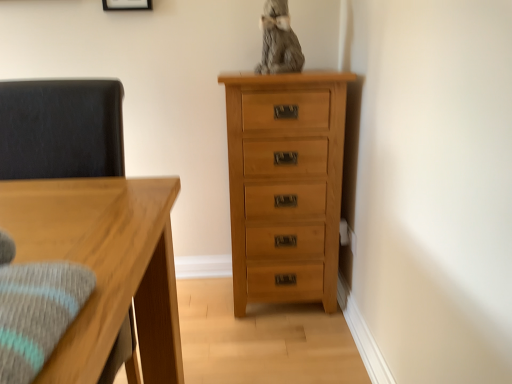
Question: In terms of size, does natural wood chest of drawers at right appear bigger or smaller than matte white picture frame at upper center?

Choices:
 (A) big
 (B) small

Answer: (A)

Question: Does point (240, 220) appear closer or farther from the camera than point (112, 4)?

Choices:
 (A) farther
 (B) closer

Answer: (B)

Question: Which object is positioned closest to the natural wood chest of drawers at right?

Choices:
 (A) matte white picture frame at upper center
 (B) dark gray fabric swivel chair at left

Answer: (B)

Question: Which object is positioned farthest from the natural wood chest of drawers at right?

Choices:
 (A) dark gray fabric swivel chair at left
 (B) matte white picture frame at upper center

Answer: (B)